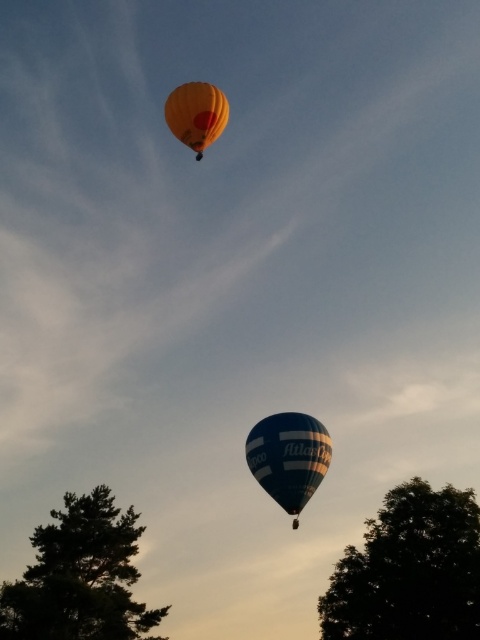
You are a bird flying near the green leafy tree at lower left and the blue striped fabric hot air balloon at lower center. Which object is taller from the ground?

The green leafy tree at lower left is taller than the blue striped fabric hot air balloon at lower center according to the description provided.

You are standing at the point with coordinates point [409,570] in the image. What object are you at?

You are at the dark green leafy tree at lower right.

You are standing at the point marked by coordinates point (80, 577). Looking around, you see two hot air balloons and a green leafy tree at lower left. Which object is directly below you?

The point (80, 577) is on the green leafy tree at lower left, so the green leafy tree at lower left is directly below you.